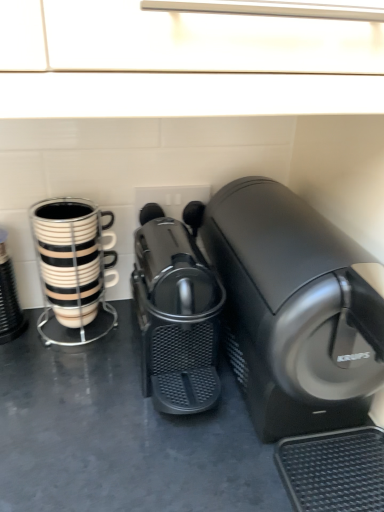
Question: In terms of width, does black and white striped mug at left look wider or thinner when compared to black glossy coffee cup at left?

Choices:
 (A) wide
 (B) thin

Answer: (B)

Question: Would you say black and white striped mug at left is to the left or to the right of black glossy coffee cup at left in the picture?

Choices:
 (A) right
 (B) left

Answer: (A)

Question: Estimate the real-world distances between objects in this image. Which object is farther from the black plastic coffee machine at center, marked as the first home appliance in a right-to-left arrangement?

Choices:
 (A) black and white striped mug at left
 (B) black glossy coffee cup at left
 (C) black plastic coffee machine at center, which ranks as the 2th home appliance in right-to-left order

Answer: (B)

Question: Which object is positioned closest to the black glossy coffee cup at left?

Choices:
 (A) black plastic coffee machine at center, marked as the first home appliance in a right-to-left arrangement
 (B) black plastic coffee machine at center, the 1th home appliance in the left-to-right sequence
 (C) black and white striped mug at left

Answer: (C)